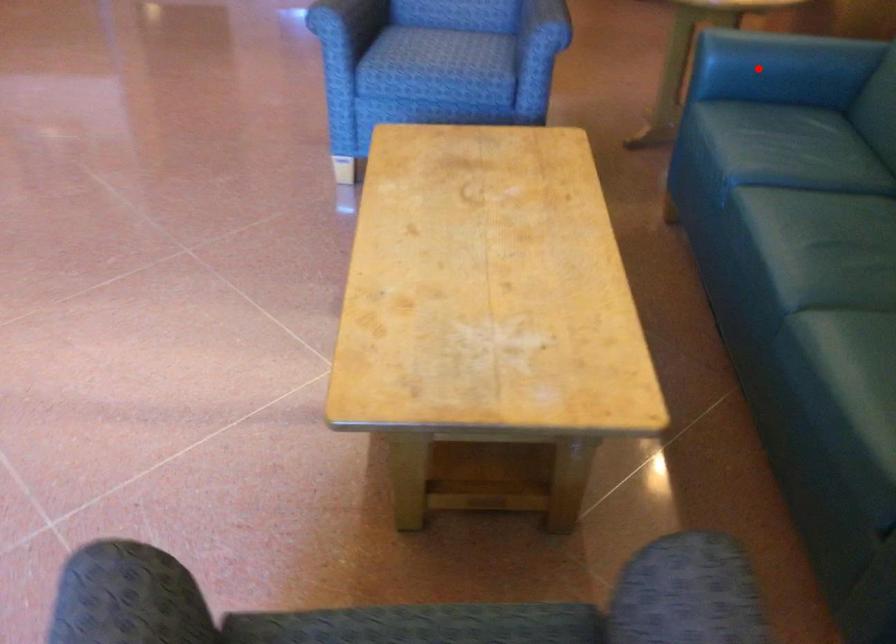
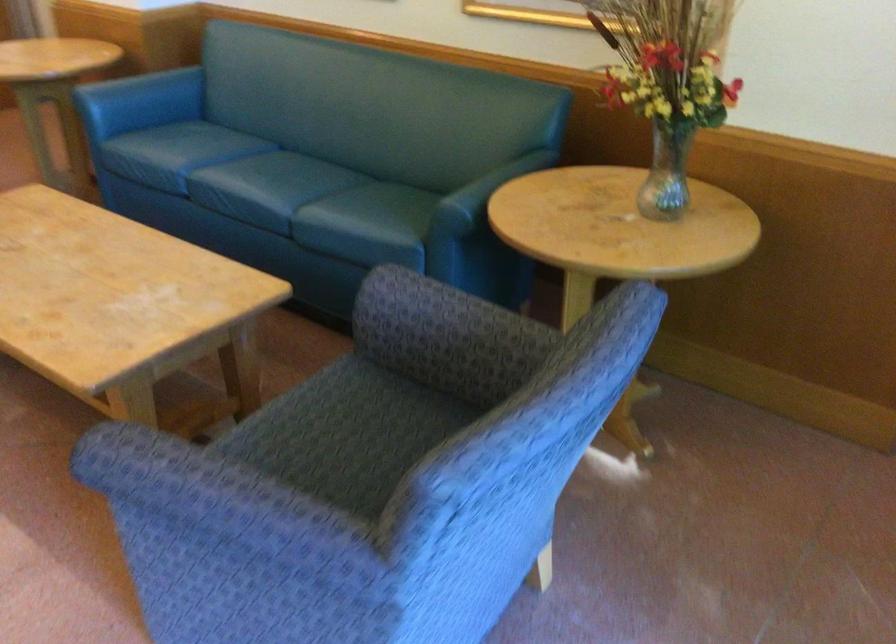
Question: I am providing you with two images of the same scene from different viewpoints. Image1 has a red point marked. In image2, the corresponding 3D location appears at what relative position? Reply with the corresponding letter.

Choices:
 (A) Closer
 (B) Farther

Answer: (B)